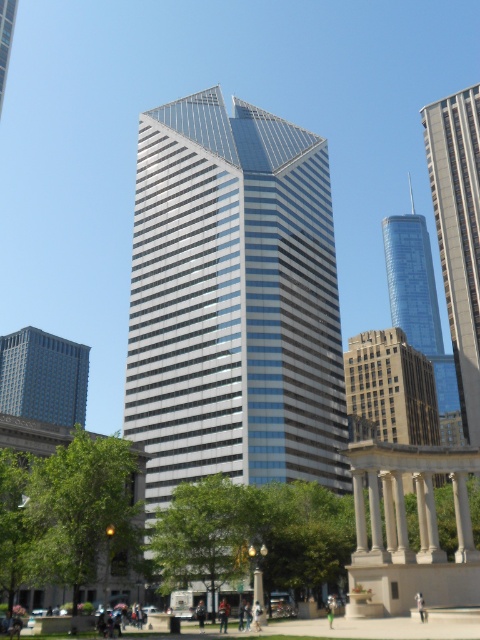
You are standing at the center of the image looking towards the skyscraper. Which direction should you turn to face the green leafy tree represented by point (68, 513)?

The green leafy tree represented by point (68, 513) is located at the lower left of the image, so you should turn to your left to face it.

You are a city planner assessing the urban layout. You need to determine if the green leafy tree at lower left can provide shade to the glassy steel skyscraper at right during the afternoon. Based on their relative heights, is this possible?

The green leafy tree at lower left is not as tall as the glassy steel skyscraper at right, so it cannot provide shade to the skyscraper during the afternoon.

You are standing in the middle of the urban landscape looking at the skyscraper. There are two points marked on the building. One is at coordinate point (51, 528) and the other at point (250, 490). Which point is closer to you?

Point (51, 528) is closer to the viewer than point (250, 490).